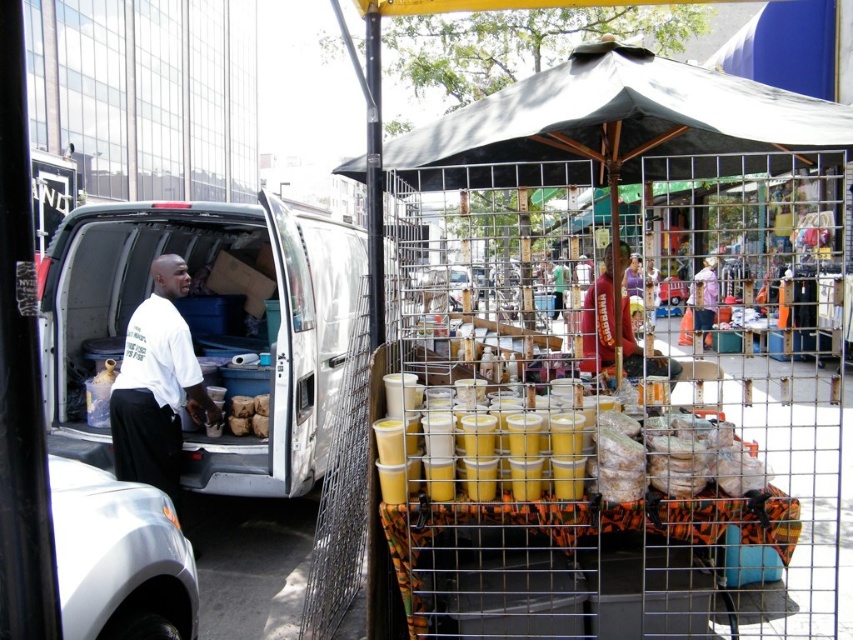
Question: Which point is closer to the camera?

Choices:
 (A) white matte van at left
 (B) yellow matte cups at center
 (C) white matte shirt at left

Answer: (B)

Question: Can you confirm if yellow matte cups at center is positioned below white matte shirt at left?

Choices:
 (A) no
 (B) yes

Answer: (B)

Question: Can you confirm if white matte van at left is smaller than yellow matte cups at center?

Choices:
 (A) no
 (B) yes

Answer: (A)

Question: Does yellow matte cups at center have a larger size compared to white matte shirt at left?

Choices:
 (A) yes
 (B) no

Answer: (A)

Question: Based on their relative distances, which object is nearer to the yellow matte cups at center?

Choices:
 (A) white matte van at left
 (B) white matte shirt at left

Answer: (B)

Question: Which object appears farthest from the camera in this image?

Choices:
 (A) white matte van at left
 (B) yellow matte cups at center
 (C) white matte shirt at left

Answer: (A)